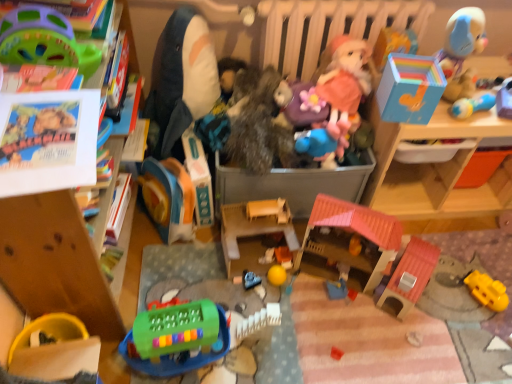
Identify the location of vacant space to the left of smooth orange block at center, the tenth toy positioned from the left. The image size is (512, 384). (239, 265).